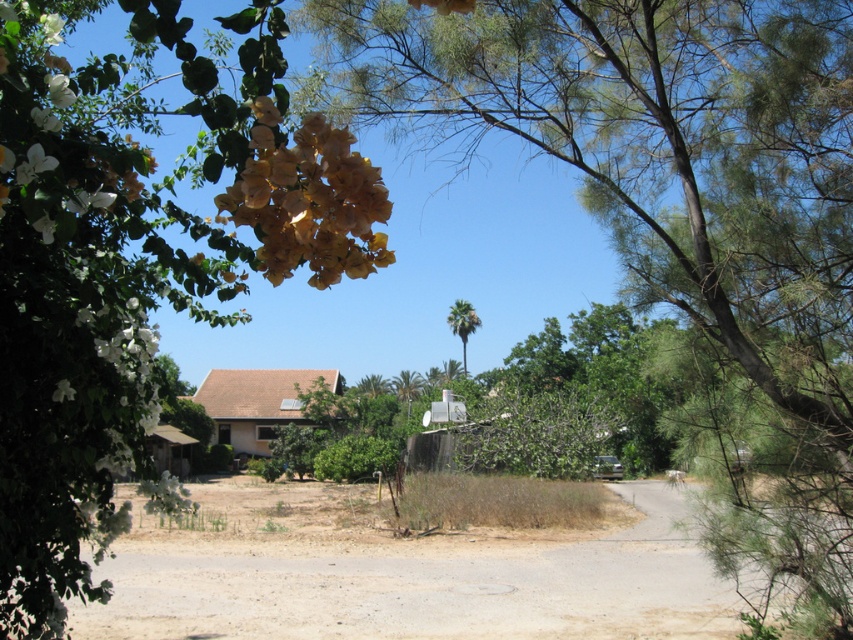
Is green leafy tree at upper right closer to camera compared to yellow matte flower at upper left?

No, it is behind yellow matte flower at upper left.

Does green leafy tree at upper right have a larger size compared to yellow matte flower at upper left?

Actually, green leafy tree at upper right might be smaller than yellow matte flower at upper left.

Who is more distant from viewer, (840, 36) or (283, 273)?

The point (840, 36) is behind.

Identify the location of green leafy tree at upper right. (680, 218).

You are a GUI agent. You are given a task and a screenshot of the screen. Output one action in this format:
    pyautogui.click(x=<x>, y=<y>)
    Task: Click on the brown dry grass at lower center
    
    Given the screenshot: What is the action you would take?
    pyautogui.click(x=409, y=572)

Which of these two, brown dry grass at lower center or green leafy palm at center, stands shorter?

Standing shorter between the two is green leafy palm at center.

From the picture: Who is more forward, (395, 579) or (466, 326)?

Positioned in front is point (395, 579).

Identify the location of brown dry grass at lower center. (409, 572).

Measure the distance from green leafy tree at upper left to yellow matte flower at upper left.

green leafy tree at upper left and yellow matte flower at upper left are 27.17 centimeters apart from each other.

Does green leafy tree at upper left lie behind yellow matte flower at upper left?

Yes, green leafy tree at upper left is further from the viewer.

Describe the element at coordinates (132, 264) in the screenshot. I see `green leafy tree at upper left` at that location.

At what (x,y) coordinates should I click in order to perform the action: click on green leafy tree at upper left. Please return your answer as a coordinate pair (x, y). This screenshot has height=640, width=853. Looking at the image, I should click on (132, 264).